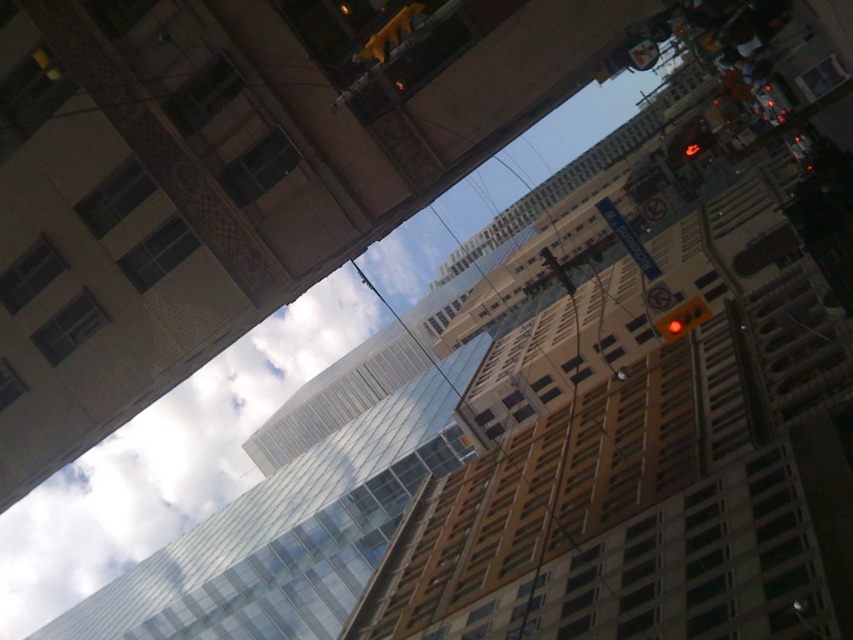
Is point (347, 337) less distant than point (387, 22)?

No, it is behind (387, 22).

Between white translucent cloud at upper center and yellow matte traffic light at upper center, which one has more height?

With more height is white translucent cloud at upper center.

Is point (181, 454) farther from viewer compared to point (358, 60)?

Yes, point (181, 454) is farther from viewer.

Identify the location of white translucent cloud at upper center. The image size is (853, 640). (167, 460).

Is yellow matte traffic light at upper center in front of yellow plastic traffic light at upper right?

That is True.

Identify the location of yellow matte traffic light at upper center. (390, 33).

Does point (386, 29) come farther from viewer compared to point (670, 336)?

No, (386, 29) is in front of (670, 336).

Identify the location of yellow matte traffic light at upper center. The width and height of the screenshot is (853, 640). (390, 33).

Does white translucent cloud at upper center have a smaller size compared to yellow plastic traffic light at upper right?

Incorrect, white translucent cloud at upper center is not smaller in size than yellow plastic traffic light at upper right.

Is point (68, 602) closer to camera compared to point (672, 323)?

No, (68, 602) is further to viewer.

The height and width of the screenshot is (640, 853). What are the coordinates of `white translucent cloud at upper center` in the screenshot? It's located at [167, 460].